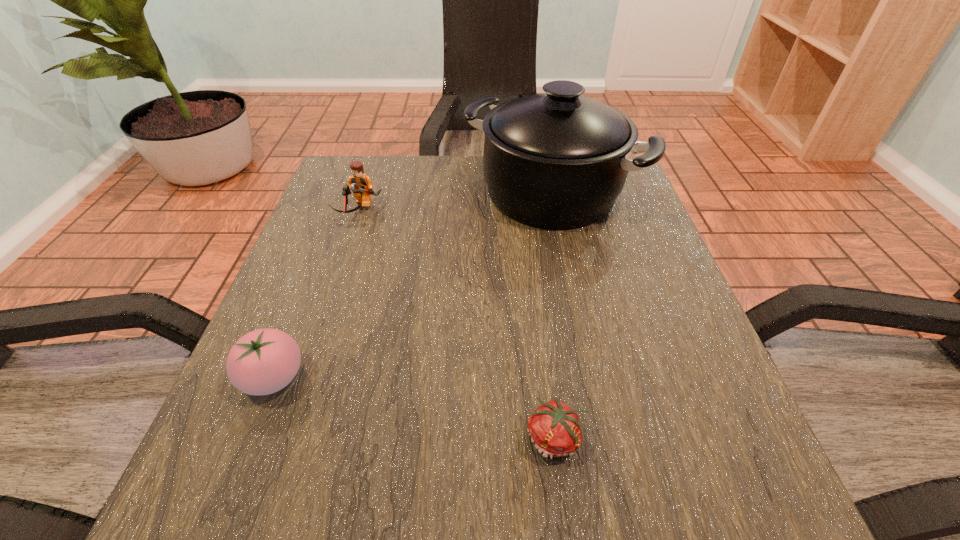
The width and height of the screenshot is (960, 540). What are the coordinates of `the tallest object` in the screenshot? It's located at pos(557,160).

Find the location of a particular element. The width and height of the screenshot is (960, 540). Lego is located at coordinates (361, 185).

Find the location of a particular element. The image size is (960, 540). the farther tomato is located at coordinates (264, 361).

I want to click on the third tallest object, so click(264, 361).

Locate an element on the screen. This screenshot has height=540, width=960. the shorter tomato is located at coordinates (555, 428).

In order to click on the shortest object in this screenshot , I will do `click(555, 428)`.

The image size is (960, 540). What are the coordinates of `vacant region located 0.110m on the front of the saucepan` in the screenshot? It's located at (566, 271).

Identify the location of free space located 0.230m holding a crossbow in the hands of the Lego. This screenshot has height=540, width=960. (328, 300).

I want to click on free space located on the right of the farther tomato, so click(x=364, y=377).

Identify the location of free region located 0.250m on the left of the shortest object. (346, 438).